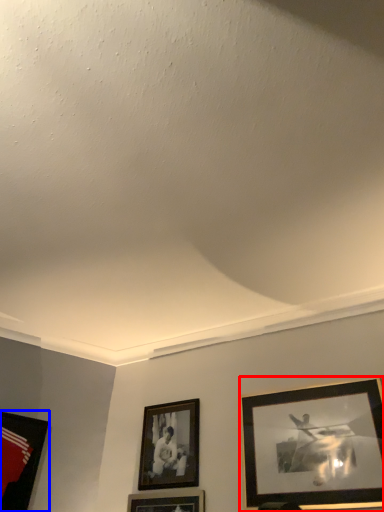
Question: Among these objects, which one is farthest to the camera, picture frame (highlighted by a red box) or picture frame (highlighted by a blue box)?

Choices:
 (A) picture frame
 (B) picture frame

Answer: (B)